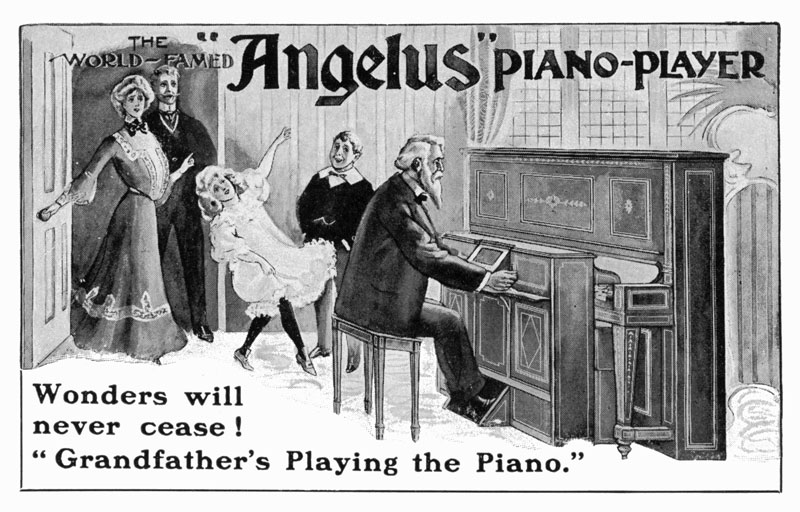
You are a GUI agent. You are given a task and a screenshot of the screen. Output one action in this format:
    pyautogui.click(x=<x>, y=<y>)
    Task: Click on the piano
    This screenshot has height=512, width=800.
    Given the screenshot: What is the action you would take?
    pyautogui.click(x=650, y=224)